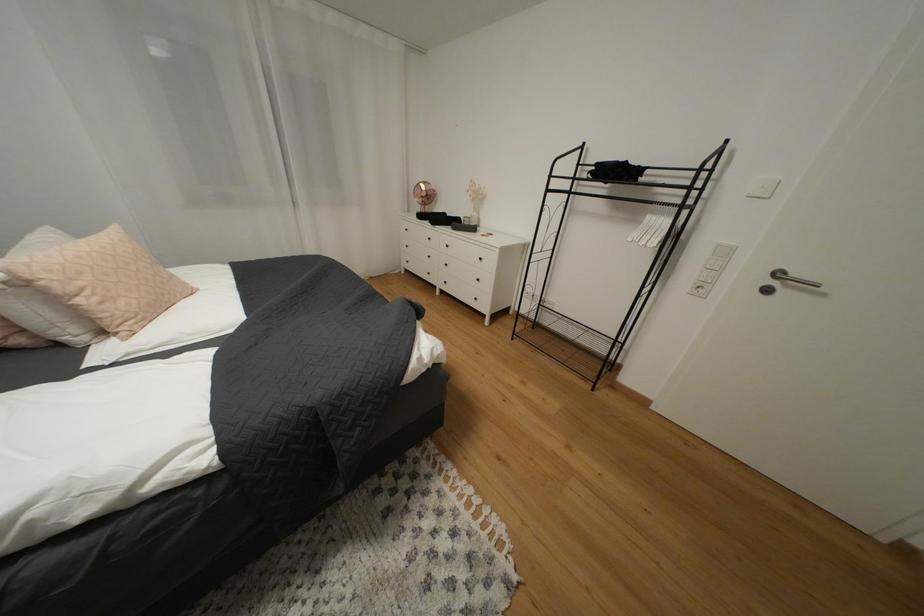
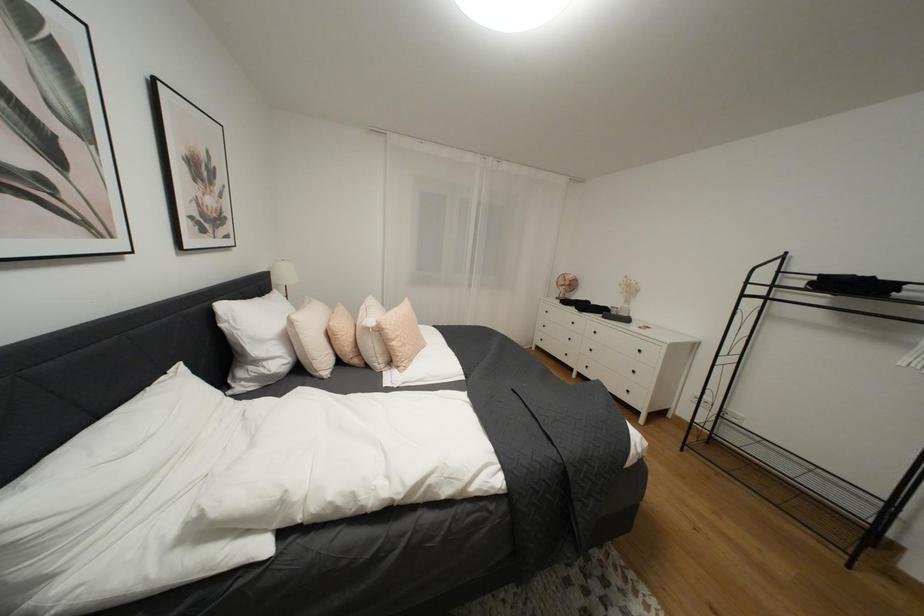
In a continuous first-person perspective shot, in which direction is the camera moving?

The cameraman walked toward left, backward.